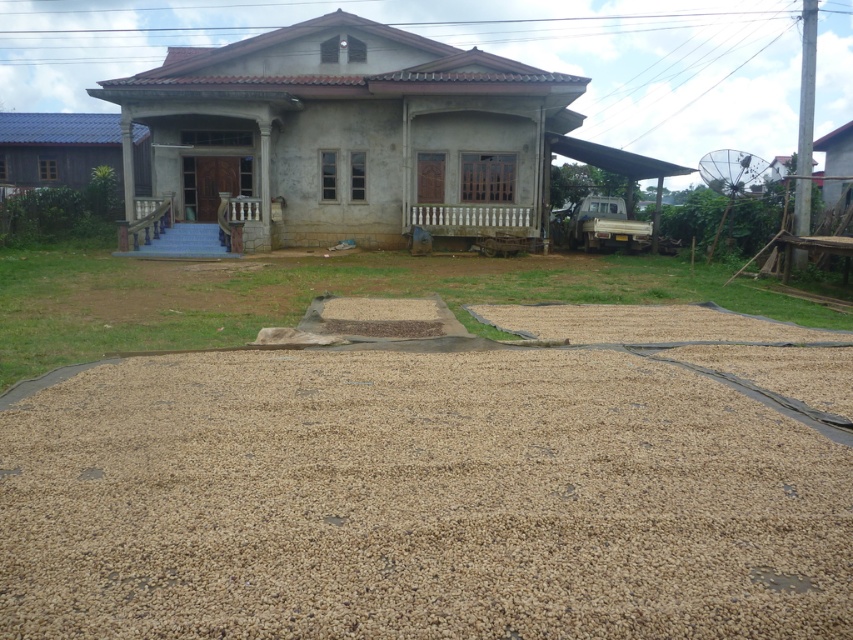
You are standing in front of the house and notice two points marked on the ground. The first point is at coordinates point (x=732, y=387) and the second is at point (x=509, y=273). Which point is closer to you?

Point (x=732, y=387) is closer to the viewer than point (x=509, y=273).

You are a delivery person standing at the entrance of the house. You need to place a heavy box on the ground near the light brown gravel at center without stepping on the gravel. Can you do this?

Yes, since the light brown gravel at center is located at point (440, 484), you can place the box near it while avoiding stepping on the gravel by positioning it around that coordinate without direct contact.